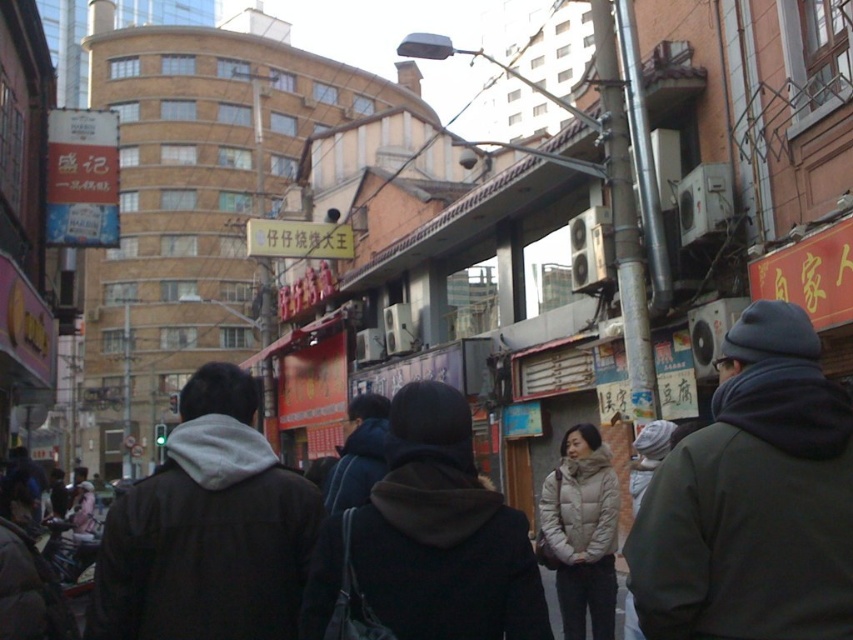
You are a photographer standing on the bustling urban street scene. You notice two items in the frame that you want to capture in a single photo. The dark gray knit hat at upper right and the white down jacket at center. Which item will appear smaller in your photo?

The dark gray knit hat at upper right will appear smaller in the photo because it is not as tall as the white down jacket at center, implying it is positioned further away from the camera.

You are standing on the bustling urban street and see two jackets worn by pedestrians. The jackets are the black fuzzy jacket at center and the white down jacket at center. Which one is positioned more to the left?

The black fuzzy jacket at center is positioned to the left of the white down jacket at center, so the black fuzzy jacket at center is more to the left.

You are a photographer standing on the street and want to capture both the dark gray knit hat at upper right and the black fuzzy jacket at center in the same frame. Which object should you focus on first to ensure both are in the shot?

The dark gray knit hat at upper right is positioned over the black fuzzy jacket at center, so you should focus on the black fuzzy jacket at center first to ensure both are in the shot.